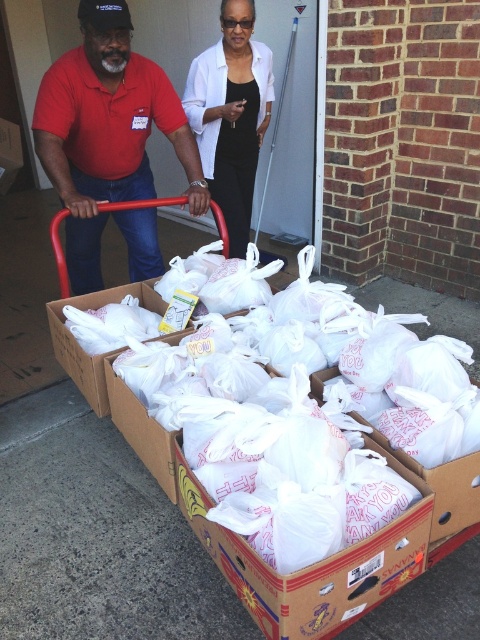
Question: Can you confirm if matte red shirt at center is positioned to the right of black satin blouse at upper center?

Choices:
 (A) yes
 (B) no

Answer: (B)

Question: Is matte red shirt at center thinner than black satin blouse at upper center?

Choices:
 (A) yes
 (B) no

Answer: (B)

Question: Does matte red shirt at center appear on the left side of black satin blouse at upper center?

Choices:
 (A) no
 (B) yes

Answer: (B)